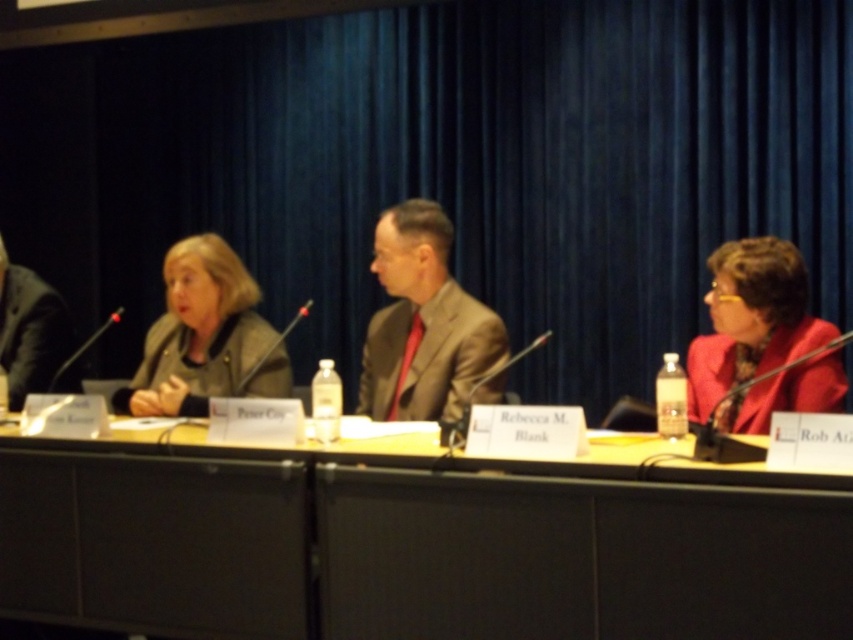
Between matte red blazer at right and black suit at left, which one appears on the left side from the viewer's perspective?

black suit at left is more to the left.

Is matte red blazer at right closer to camera compared to black suit at left?

Yes, matte red blazer at right is in front of black suit at left.

Which is in front, point (724, 317) or point (18, 308)?

Point (724, 317) is in front.

This screenshot has width=853, height=640. I want to click on matte red blazer at right, so click(751, 317).

Can you confirm if yellow wood table at center is thinner than matte brown suit at center?

No.

This screenshot has width=853, height=640. I want to click on yellow wood table at center, so click(413, 541).

You are a GUI agent. You are given a task and a screenshot of the screen. Output one action in this format:
    pyautogui.click(x=<x>, y=<y>)
    Task: Click on the yellow wood table at center
    
    Given the screenshot: What is the action you would take?
    pyautogui.click(x=413, y=541)

The height and width of the screenshot is (640, 853). What are the coordinates of `matte red blazer at right` in the screenshot? It's located at (751, 317).

Who is more distant from viewer, (746, 243) or (248, 280)?

The point (248, 280) is behind.

What do you see at coordinates (751, 317) in the screenshot? I see `matte red blazer at right` at bounding box center [751, 317].

Locate an element on the screen. This screenshot has width=853, height=640. matte red blazer at right is located at coordinates (751, 317).